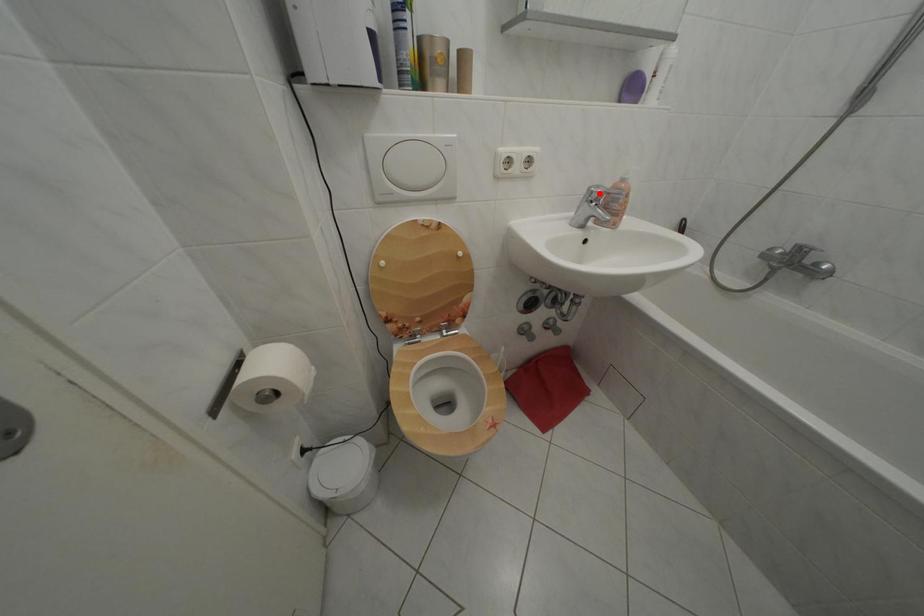
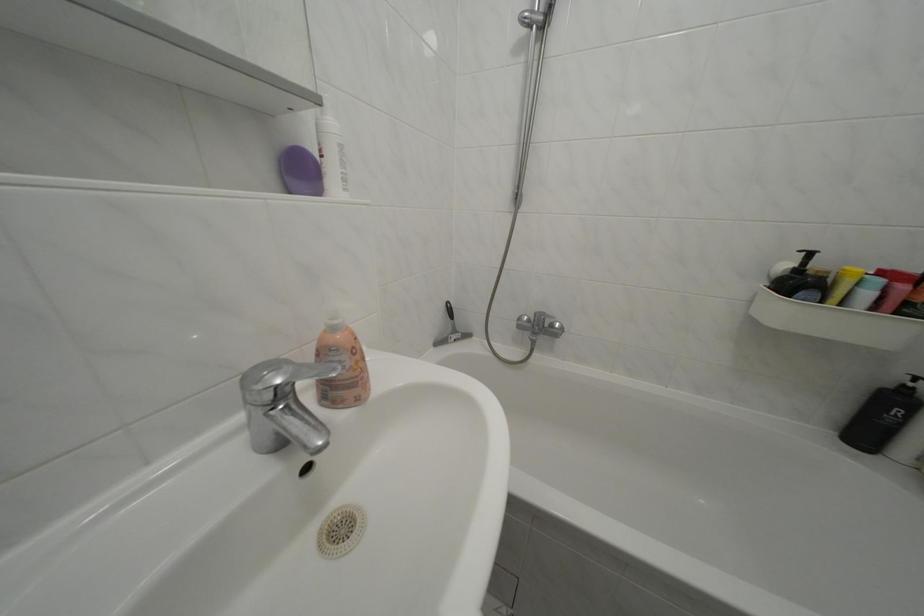
Question: I am providing you with two images of the same scene from different viewpoints. Given a red point in image1, look at the same physical point in image2. Is it:

Choices:
 (A) Closer to the viewpoint
 (B) Farther from the viewpoint

Answer: (B)